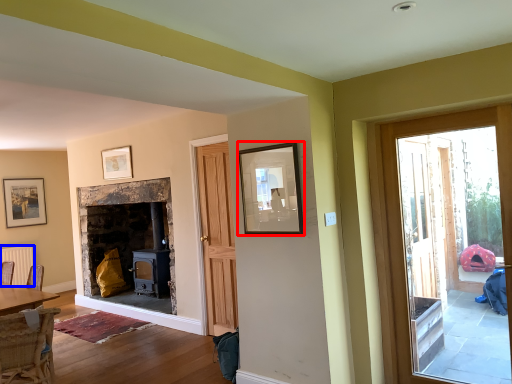
Question: Which object appears closest to the camera in this image, picture frame (highlighted by a red box) or radiator (highlighted by a blue box)?

Choices:
 (A) picture frame
 (B) radiator

Answer: (A)